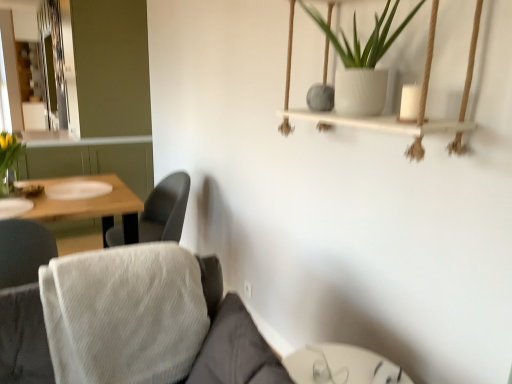
Locate an element on the screen. The image size is (512, 384). gray fabric chair at center-left is located at coordinates (165, 209).

Locate an element on the screen. transparent glass table at lower center is located at coordinates (342, 366).

The height and width of the screenshot is (384, 512). I want to click on gray fabric chair at center-left, so click(x=165, y=209).

Does white fabric couch at lower left have a lesser width compared to gray fabric chair at center-left?

In fact, white fabric couch at lower left might be wider than gray fabric chair at center-left.

Is white fabric couch at lower left not near gray fabric chair at center-left?

Yes, white fabric couch at lower left and gray fabric chair at center-left are quite far apart.

Is white fabric couch at lower left turned away from gray fabric chair at center-left?

Yes, white fabric couch at lower left's orientation is away from gray fabric chair at center-left.

Is gray fabric chair at center-left surrounded by white fabric couch at lower left?

No, white fabric couch at lower left does not contain gray fabric chair at center-left.

From a real-world perspective, is transparent glass table at lower center positioned above or below gray fabric chair at center-left?

transparent glass table at lower center is situated lower than gray fabric chair at center-left in the real world.

Between transparent glass table at lower center and gray fabric chair at center-left, which one is positioned behind?

Positioned behind is gray fabric chair at center-left.

The image size is (512, 384). I want to click on chair that is on the left side of transparent glass table at lower center, so [x=165, y=209].

Between transparent glass table at lower center and gray fabric chair at center-left, which one has more height?

gray fabric chair at center-left.

From a real-world perspective, is clear glass vase at left physically above gray fabric chair at center-left?

Correct, in the physical world, clear glass vase at left is higher than gray fabric chair at center-left.

From their relative heights in the image, would you say clear glass vase at left is taller or shorter than gray fabric chair at center-left?

Clearly, clear glass vase at left is shorter compared to gray fabric chair at center-left.

Is point (10, 188) less distant than point (165, 185)?

Yes, it is in front of point (165, 185).

Does clear glass vase at left come behind gray fabric chair at center-left?

That is False.

From the image's perspective, is white textured pot at upper center beneath clear glass vase at left?

No, from the image's perspective, white textured pot at upper center is not below clear glass vase at left.

Find the location of a particular element. This screenshot has width=512, height=384. glass vase behind the white textured pot at upper center is located at coordinates (7, 183).

Which object is further away from the camera, white textured pot at upper center or clear glass vase at left?

clear glass vase at left is further from the camera.

Which is more to the left, white textured pot at upper center or clear glass vase at left?

clear glass vase at left.

Looking at this image, how different are the orientations of transparent glass table at lower center and white textured pot at upper center in degrees?

90 degrees separate the facing orientations of transparent glass table at lower center and white textured pot at upper center.

Choose the correct answer: Is transparent glass table at lower center inside white textured pot at upper center or outside it?

transparent glass table at lower center is not enclosed by white textured pot at upper center.

How distant is transparent glass table at lower center from white textured pot at upper center?

transparent glass table at lower center is 39.26 inches from white textured pot at upper center.

Is transparent glass table at lower center oriented towards white textured pot at upper center?

No, transparent glass table at lower center is not aimed at white textured pot at upper center.

In the scene shown: Is white fabric couch at lower left taller than transparent glass table at lower center?

Yes.

Is white fabric couch at lower left at the right side of transparent glass table at lower center?

Incorrect, white fabric couch at lower left is not on the right side of transparent glass table at lower center.

Based on the photo, is white fabric couch at lower left with transparent glass table at lower center?

They are not placed beside each other.

Image resolution: width=512 pixels, height=384 pixels. What are the coordinates of `couch that is above the transparent glass table at lower center (from the image's perspective)` in the screenshot? It's located at (231, 339).

Considering the positions of objects white textured pot at upper center and gray fabric chair at center-left in the image provided, who is in front, white textured pot at upper center or gray fabric chair at center-left?

white textured pot at upper center is closer to the camera.

Is white textured pot at upper center oriented towards gray fabric chair at center-left?

No.

Considering the sizes of objects white textured pot at upper center and gray fabric chair at center-left in the image provided, who is thinner, white textured pot at upper center or gray fabric chair at center-left?

white textured pot at upper center.

Measure the distance between white textured pot at upper center and gray fabric chair at center-left.

They are 1.64 meters apart.

Where is `couch in front of the gray fabric chair at center-left`? This screenshot has height=384, width=512. couch in front of the gray fabric chair at center-left is located at coordinates (x=231, y=339).

This screenshot has width=512, height=384. I want to click on glass table located below the gray fabric chair at center-left (from the image's perspective), so click(342, 366).

When comparing their distances from gray fabric chair at center-left, does clear glass vase at left or white fabric couch at lower left seem further?

white fabric couch at lower left.

When comparing their distances from transparent glass table at lower center, does clear glass vase at left or gray fabric chair at center-left seem further?

clear glass vase at left lies further to transparent glass table at lower center than the other object.

Which object lies nearer to the anchor point gray fabric chair at center-left, white fabric couch at lower left or white textured pot at upper center?

Among the two, white fabric couch at lower left is located nearer to gray fabric chair at center-left.

Looking at the image, which one is located further to clear glass vase at left, transparent glass table at lower center or gray fabric chair at center-left?

transparent glass table at lower center is positioned further to the anchor clear glass vase at left.

Which object lies nearer to the anchor point white fabric couch at lower left, clear glass vase at left or white textured pot at upper center?

white textured pot at upper center.

Estimate the real-world distances between objects in this image. Which object is closer to gray fabric chair at center-left, white fabric couch at lower left or clear glass vase at left?

clear glass vase at left is positioned closer to the anchor gray fabric chair at center-left.

Which object lies further to the anchor point clear glass vase at left, gray fabric chair at center-left or transparent glass table at lower center?

transparent glass table at lower center is further to clear glass vase at left.

Which object lies nearer to the anchor point white textured pot at upper center, gray fabric chair at center-left or white fabric couch at lower left?

white fabric couch at lower left is closer to white textured pot at upper center.

This screenshot has height=384, width=512. In order to click on couch between white textured pot at upper center and transparent glass table at lower center from top to bottom in this screenshot , I will do `click(231, 339)`.

Where is `chair situated between clear glass vase at left and white textured pot at upper center from left to right`? chair situated between clear glass vase at left and white textured pot at upper center from left to right is located at coordinates (165, 209).

I want to click on couch between clear glass vase at left and white textured pot at upper center in the horizontal direction, so click(231, 339).

At what (x,y) coordinates should I click in order to perform the action: click on couch between clear glass vase at left and transparent glass table at lower center in the horizontal direction. Please return your answer as a coordinate pair (x, y). This screenshot has height=384, width=512. Looking at the image, I should click on (231, 339).